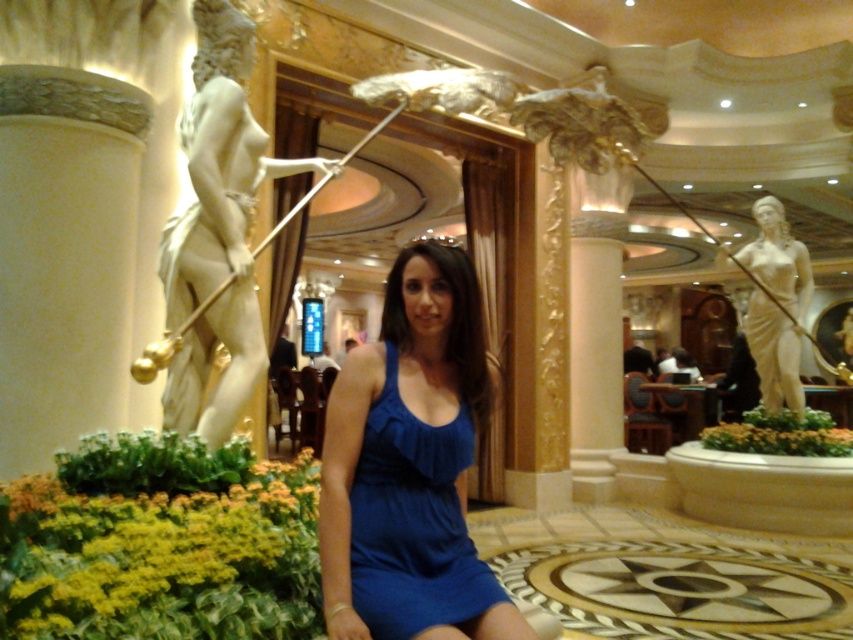
You are a photographer setting up for a photoshoot in this luxurious setting. You need to ensure that the white marble statue at left and the matte blue dress at center are both visible in the frame. Considering their heights, which object will appear larger in the photo?

The white marble statue at left is taller than the matte blue dress at center, so it will appear larger in the photo.